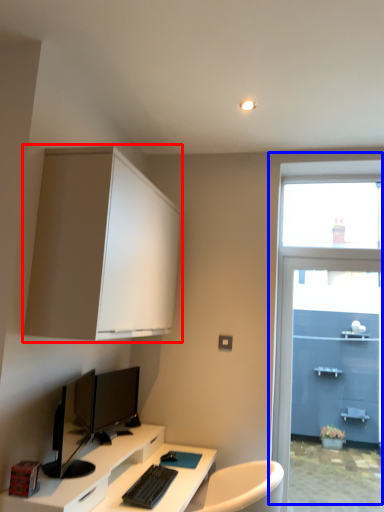
Question: Which point is closer to the camera, cabinetry (highlighted by a red box) or window (highlighted by a blue box)?

Choices:
 (A) cabinetry
 (B) window

Answer: (A)